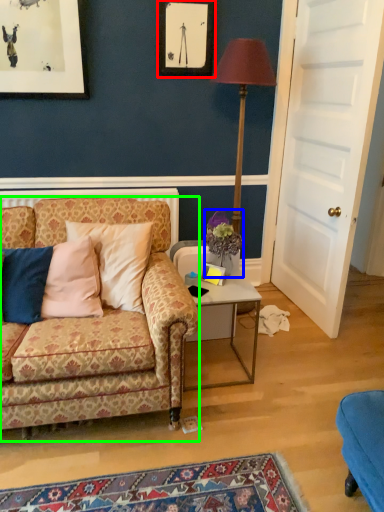
Question: Which object is positioned closest to picture frame (highlighted by a red box)? Select from flower (highlighted by a blue box) and studio couch (highlighted by a green box).

Choices:
 (A) flower
 (B) studio couch

Answer: (A)